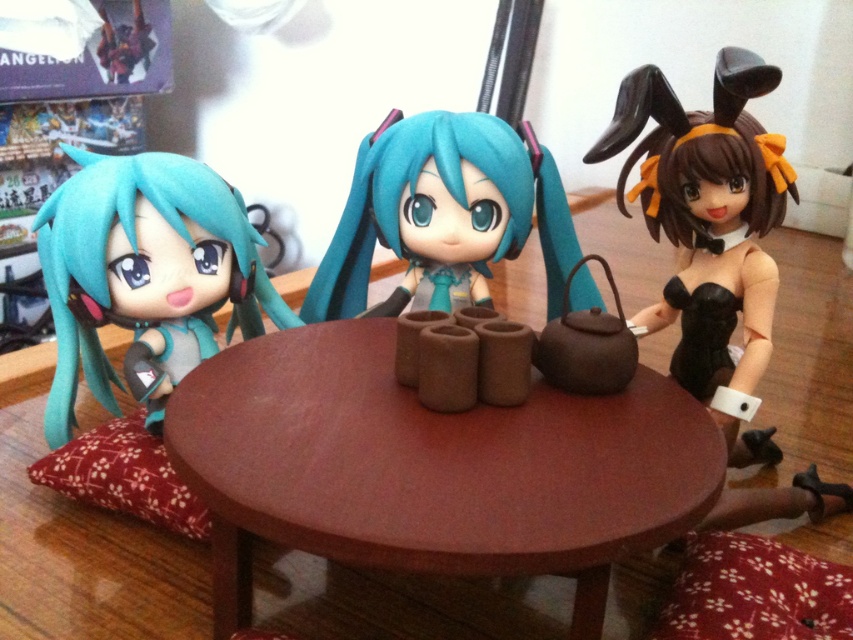
Between matte brown teapot at center and red fabric pillow at lower left, which one has less height?

Standing shorter between the two is red fabric pillow at lower left.

Does matte brown teapot at center appear on the right side of red fabric pillow at lower left?

Correct, you'll find matte brown teapot at center to the right of red fabric pillow at lower left.

The height and width of the screenshot is (640, 853). Describe the element at coordinates (410, 188) in the screenshot. I see `matte brown teapot at center` at that location.

This screenshot has width=853, height=640. I want to click on matte brown teapot at center, so click(410, 188).

Does brown matte table at center appear under matte teal hair at left?

Correct, brown matte table at center is located below matte teal hair at left.

Is brown matte table at center smaller than matte teal hair at left?

No, brown matte table at center is not smaller than matte teal hair at left.

The height and width of the screenshot is (640, 853). In order to click on brown matte table at center in this screenshot , I will do `click(428, 468)`.

What do you see at coordinates (428, 468) in the screenshot? I see `brown matte table at center` at bounding box center [428, 468].

Which is more to the right, brown matte table at center or black satin dress at right?

black satin dress at right is more to the right.

Does point (242, 346) come farther from viewer compared to point (704, 220)?

No, (242, 346) is in front of (704, 220).

Locate an element on the screen. brown matte table at center is located at coordinates (428, 468).